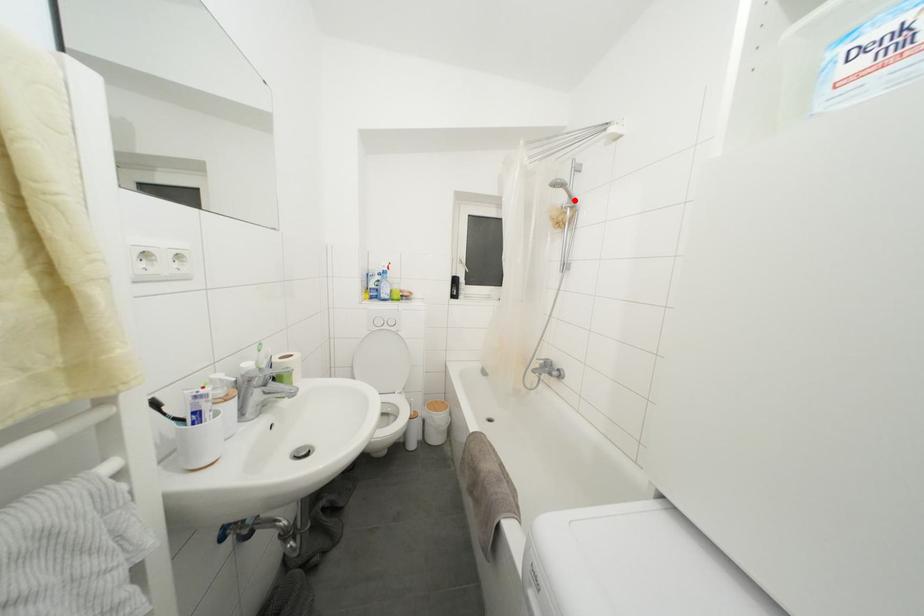
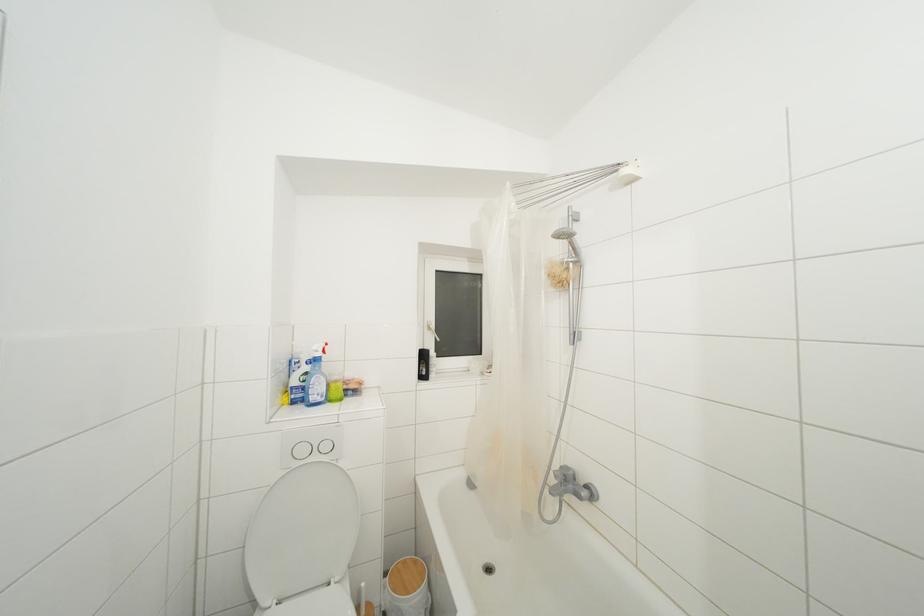
Find the pixel in the second image that matches the highlighted location in the first image.

(578, 254)